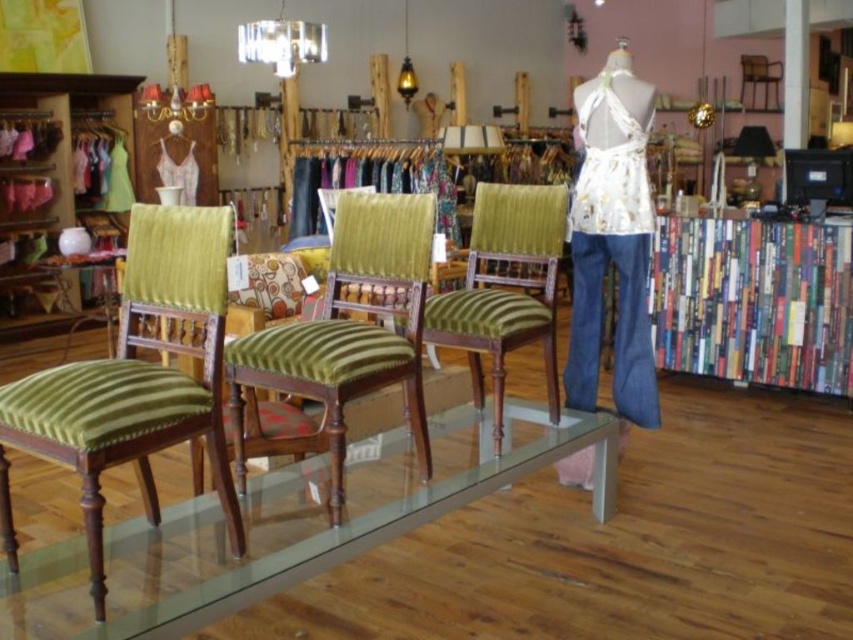
Question: Is matte wood bookshelf at left to the right of green striped fabric chair at center from the viewer's perspective?

Choices:
 (A) yes
 (B) no

Answer: (B)

Question: Does transparent glass table at center appear on the left side of white floral fabric at center?

Choices:
 (A) yes
 (B) no

Answer: (A)

Question: Which object is the farthest from the metallic glass chandelier at upper center?

Choices:
 (A) green striped fabric chair at center
 (B) transparent glass table at center

Answer: (B)

Question: Estimate the real-world distances between objects in this image. Which object is farther from the green velvet chair at left?

Choices:
 (A) white floral fabric at center
 (B) green velvet chair at center
 (C) metallic glass chandelier at upper center

Answer: (C)

Question: Does green velvet chair at left have a lesser width compared to green striped fabric chair at center?

Choices:
 (A) yes
 (B) no

Answer: (B)

Question: Which point is closer to the camera?

Choices:
 (A) (751, 364)
 (B) (160, 588)
 (C) (294, 70)
 (D) (141, 417)

Answer: (D)